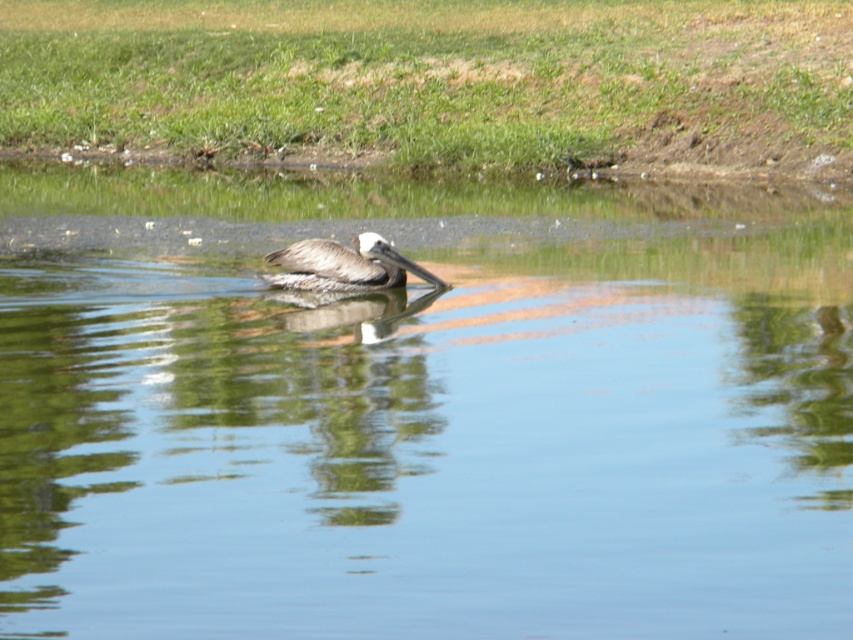
Is point (230, 276) positioned before point (392, 273)?

No.

Who is higher up, clear water at center or brown feathered pelican at center?

clear water at center

Is point (236, 371) farther from viewer compared to point (277, 285)?

That is False.

Find the location of a particular element. This screenshot has height=640, width=853. clear water at center is located at coordinates (422, 412).